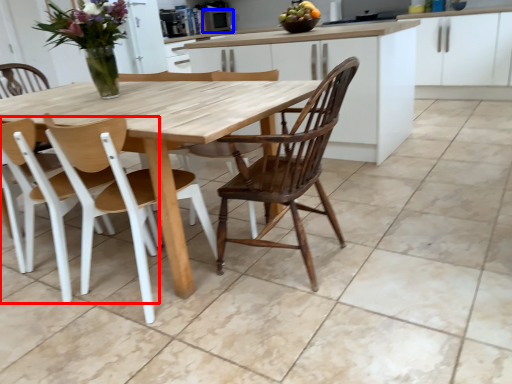
Question: Which object appears closest to the camera in this image, chair (highlighted by a red box) or appliance (highlighted by a blue box)?

Choices:
 (A) chair
 (B) appliance

Answer: (A)